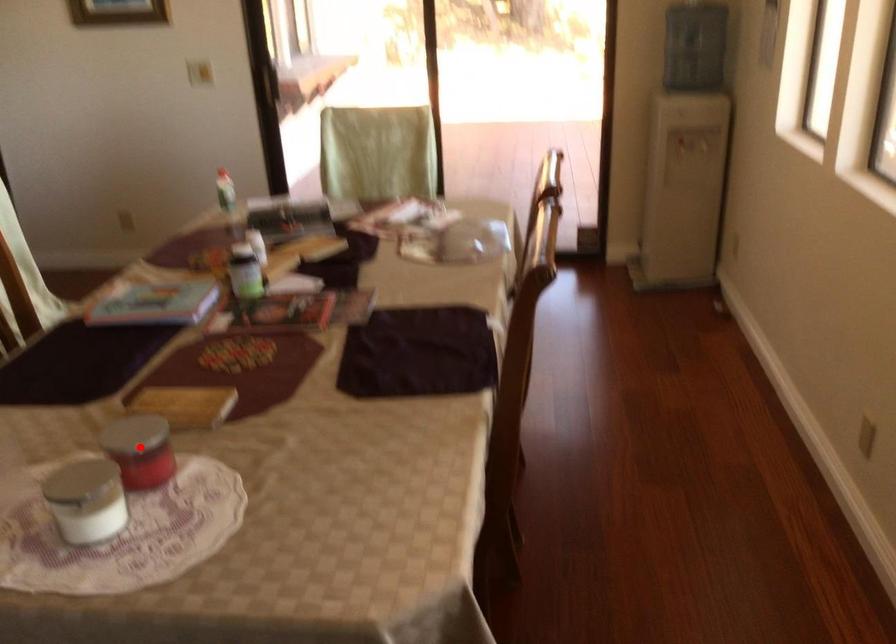
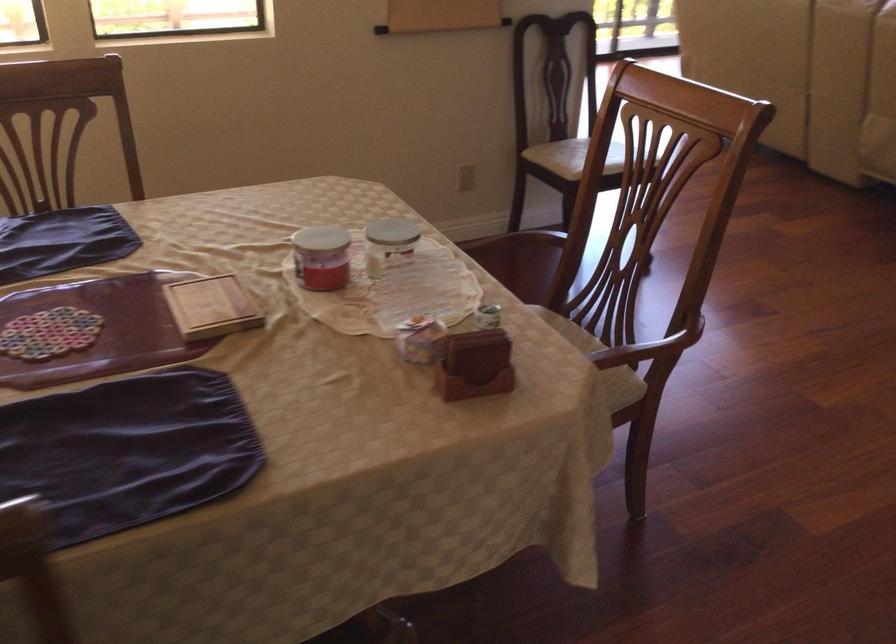
Where in the second image is the point corresponding to the highlighted location from the first image?

(321, 257)